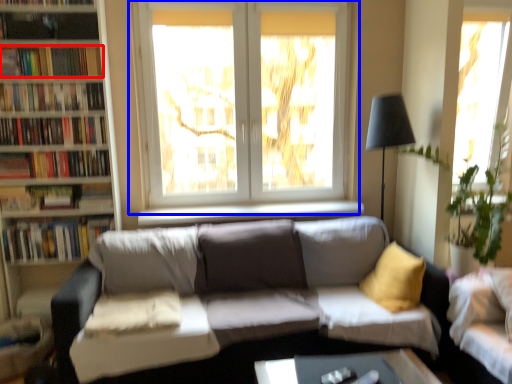
Question: Which point is closer to the camera, book (highlighted by a red box) or window (highlighted by a blue box)?

Choices:
 (A) book
 (B) window

Answer: (A)